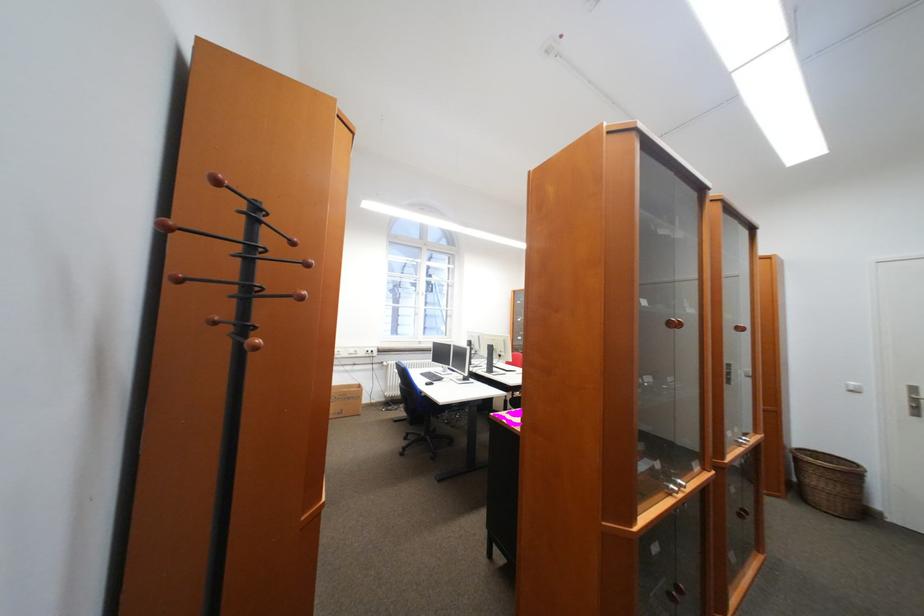
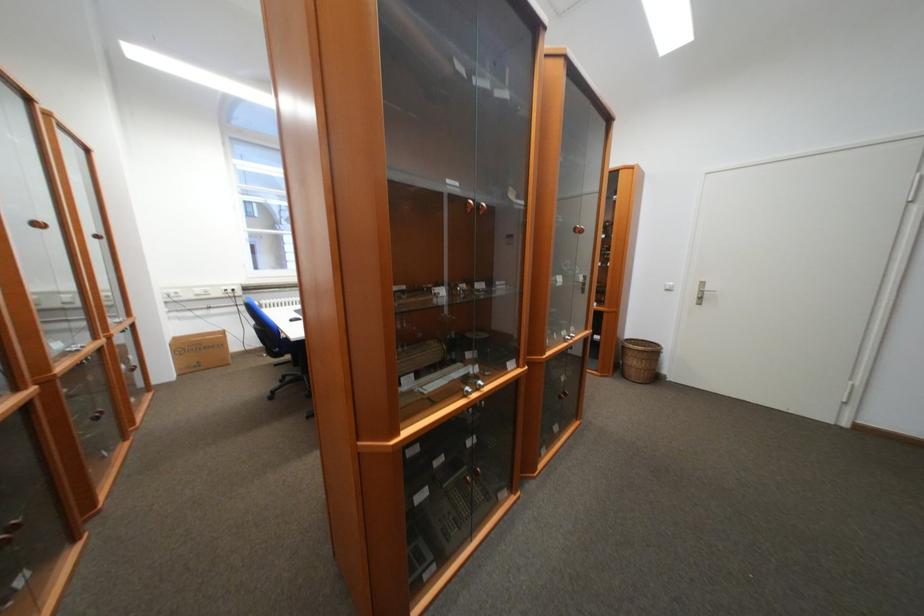
Locate, in the second image, the point that corresponds to point 676,487 in the first image.

(472, 390)